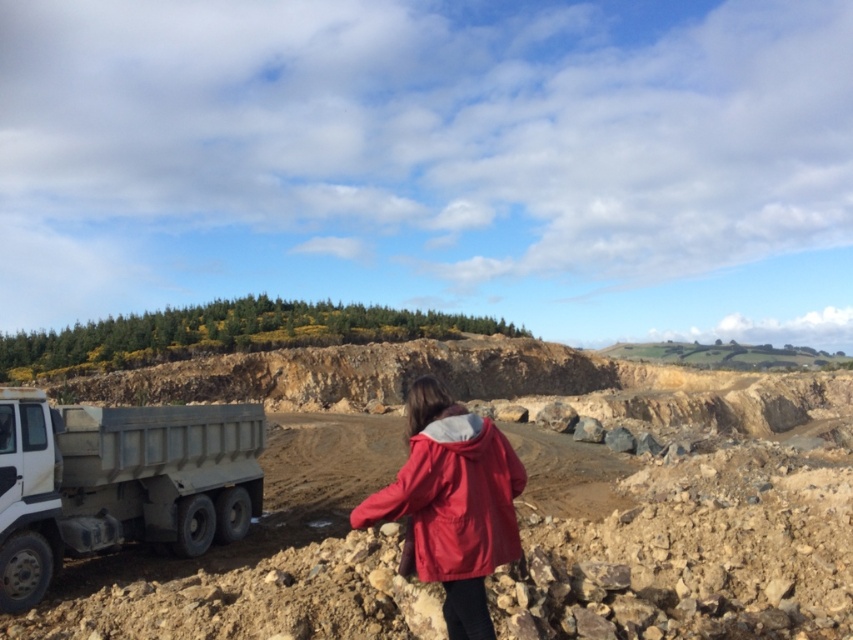
Can you confirm if white metallic truck at lower left is positioned above matte gray truck at lower left?

No, white metallic truck at lower left is not above matte gray truck at lower left.

In order to click on white metallic truck at lower left in this screenshot , I will do `click(621, 481)`.

What do you see at coordinates (621, 481) in the screenshot?
I see `white metallic truck at lower left` at bounding box center [621, 481].

The height and width of the screenshot is (640, 853). What are the coordinates of `white metallic truck at lower left` in the screenshot? It's located at (621, 481).

Which of these two, white metallic truck at lower left or matte red jacket at center, stands taller?

With more height is white metallic truck at lower left.

Is white metallic truck at lower left shorter than matte red jacket at center?

No, white metallic truck at lower left is not shorter than matte red jacket at center.

Which is in front, point (764, 570) or point (505, 557)?

Point (505, 557) is more forward.

Locate an element on the screen. This screenshot has width=853, height=640. white metallic truck at lower left is located at coordinates (621, 481).

Is matte gray truck at lower left bigger than matte red jacket at center?

Indeed, matte gray truck at lower left has a larger size compared to matte red jacket at center.

Locate an element on the screen. This screenshot has height=640, width=853. matte gray truck at lower left is located at coordinates (119, 483).